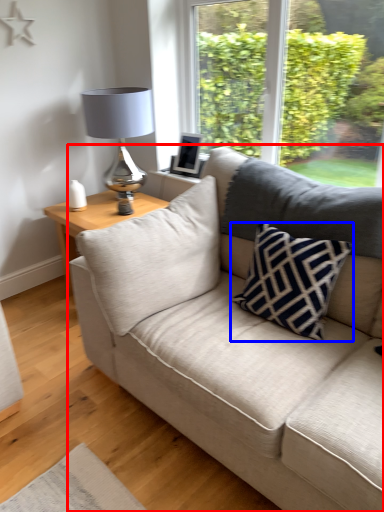
Question: Which of the following is the farthest to the observer, studio couch (highlighted by a red box) or pillow (highlighted by a blue box)?

Choices:
 (A) studio couch
 (B) pillow

Answer: (B)